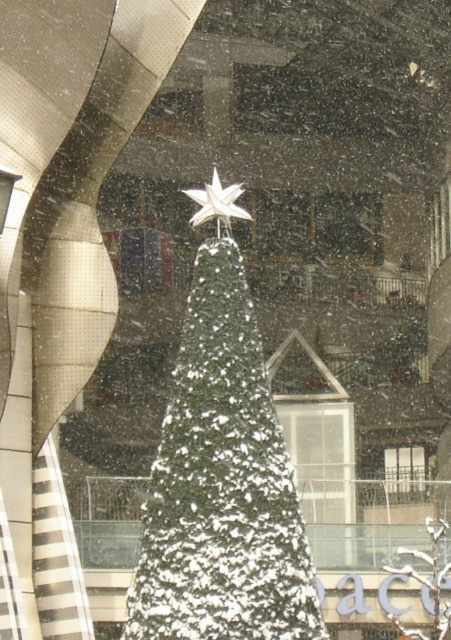
Question: Estimate the real-world distances between objects in this image. Which object is farther from the snow-covered green christmas tree at center?

Choices:
 (A) white glossy star at center
 (B) clear glass window at center

Answer: (B)

Question: Which object appears closest to the camera in this image?

Choices:
 (A) clear glass window at center
 (B) snow-covered green christmas tree at center

Answer: (B)

Question: Does white glossy star at center come in front of clear glass window at center?

Choices:
 (A) yes
 (B) no

Answer: (A)

Question: Which of the following is the closest to the observer?

Choices:
 (A) white glossy star at center
 (B) snow-covered green christmas tree at center
 (C) clear glass window at center

Answer: (B)

Question: Does white glossy star at center have a lesser width compared to clear glass window at center?

Choices:
 (A) no
 (B) yes

Answer: (B)

Question: Where is snow-covered green christmas tree at center located in relation to white glossy star at center in the image?

Choices:
 (A) above
 (B) below

Answer: (B)